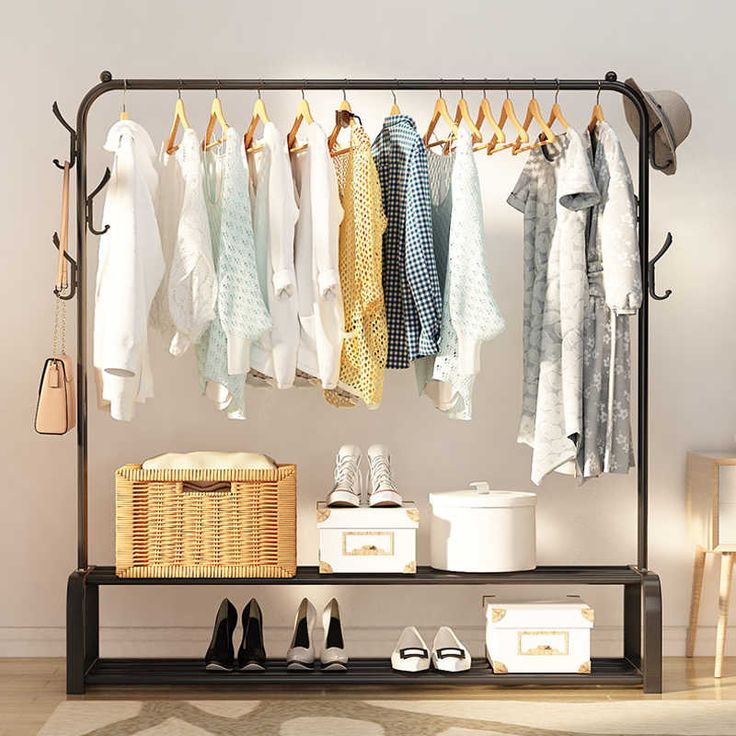
Where is `hooks`? This screenshot has height=736, width=736. hooks is located at coordinates (71, 106), (104, 177), (49, 254), (659, 249), (648, 143).